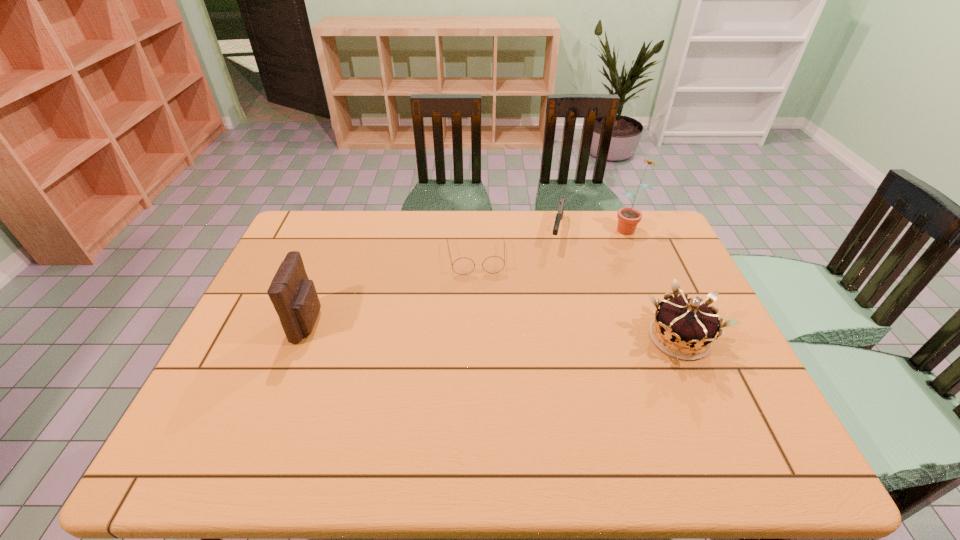
Point out which object is positioned as the nearest to the fourth tallest object. Please provide its 2D coordinates. Your answer should be formatted as a tuple, i.e. [(x, y)], where the tuple contains the x and y coordinates of a point satisfying the conditions above.

[(493, 264)]

Identify which object is the third closest to the sunflower. Please provide its 2D coordinates. Your answer should be formatted as a tuple, i.e. [(x, y)], where the tuple contains the x and y coordinates of a point satisfying the conditions above.

[(493, 264)]

The width and height of the screenshot is (960, 540). Find the location of `free spot that satisfies the following two spatial constraints: 1. on the front side of the gun; 2. on the right side of the third tallest object`. free spot that satisfies the following two spatial constraints: 1. on the front side of the gun; 2. on the right side of the third tallest object is located at coordinates (581, 338).